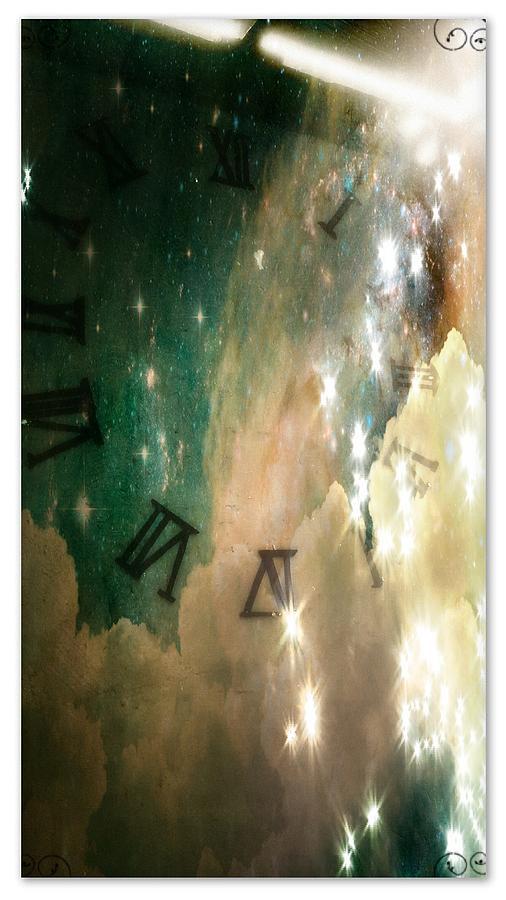
Locate an element on the screen. light behind clock is located at coordinates (340, 69), (203, 28).